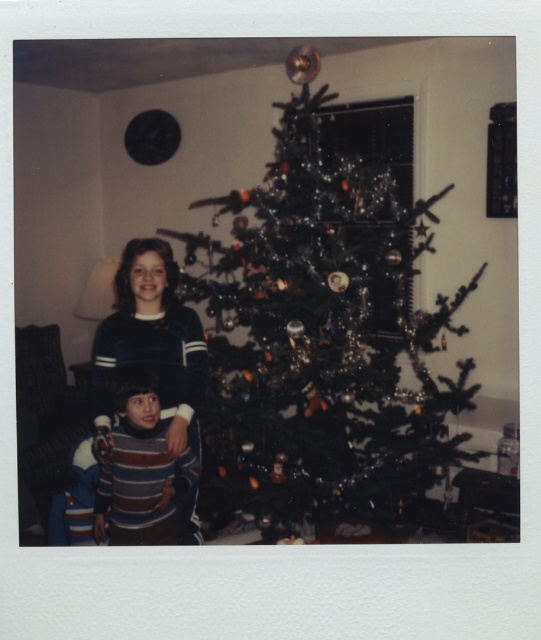
Based on the scene description, where is the green shiny christmas tree at center located in terms of its 2D coordinates?

The green shiny christmas tree at center is located at the 2D coordinates of point (325, 323).

You are standing in front of the Christmas tree and want to place a gift exactly at the point marked as point (325,323). According to the scene description, where on the Christmas tree should you place the gift?

The point (325,323) is located on the green shiny Christmas tree at center, so you should place the gift on the green shiny Christmas tree at center.

You are a parent trying to choose a coat for your children. The coats available are exactly the same size as their current sweaters. If you have a coat that fits the blue striped sweater at left, will it also fit the striped sweater at lower left?

The blue striped sweater at left is wider than the striped sweater at lower left. Since the coat is made to fit the blue striped sweater at left, it should also accommodate the narrower striped sweater at lower left.